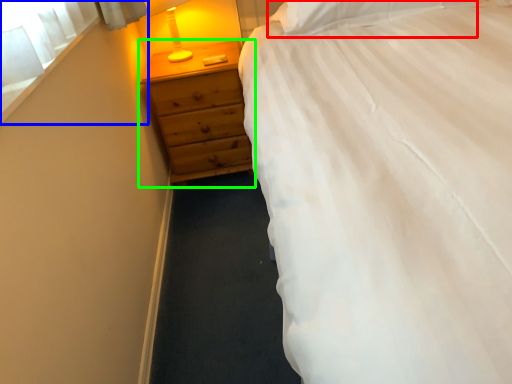
Question: Which is nearer to the pillow (highlighted by a red box)? window screen (highlighted by a blue box) or chest of drawers (highlighted by a green box).

Choices:
 (A) window screen
 (B) chest of drawers

Answer: (B)